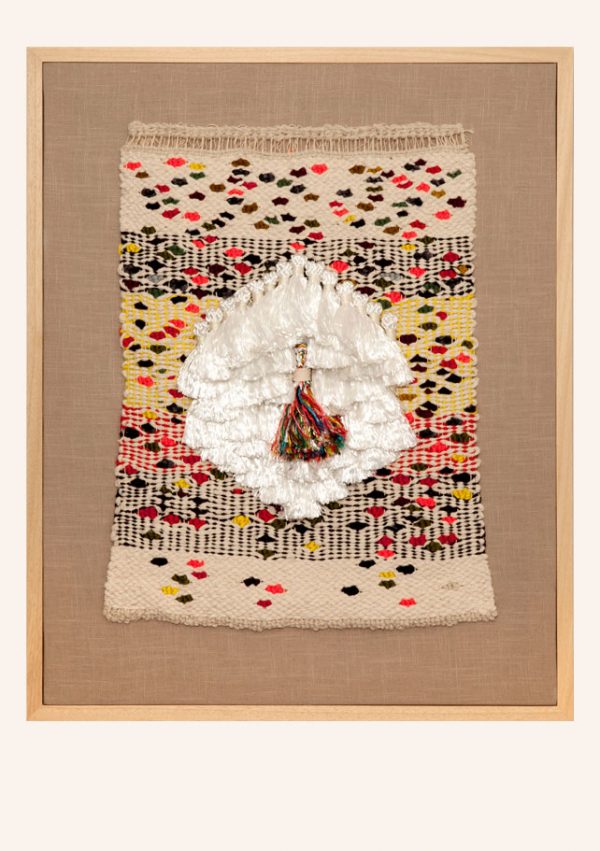
At what (x,y) coordinates should I click in order to perform the action: click on notice board. Please return your answer as a coordinate pair (x, y). Looking at the image, I should click on pos(92,424).